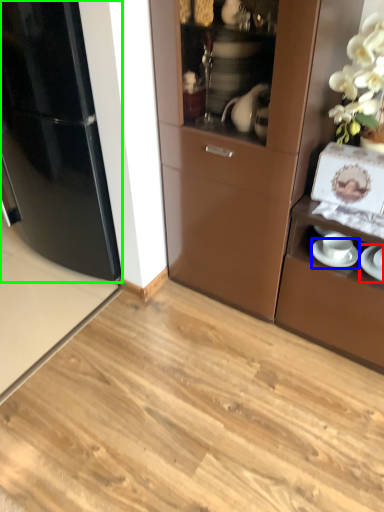
Question: Which object is the closest to the saucer (highlighted by a red box)? Choose among these: saucer (highlighted by a blue box) or refrigerator (highlighted by a green box).

Choices:
 (A) saucer
 (B) refrigerator

Answer: (A)